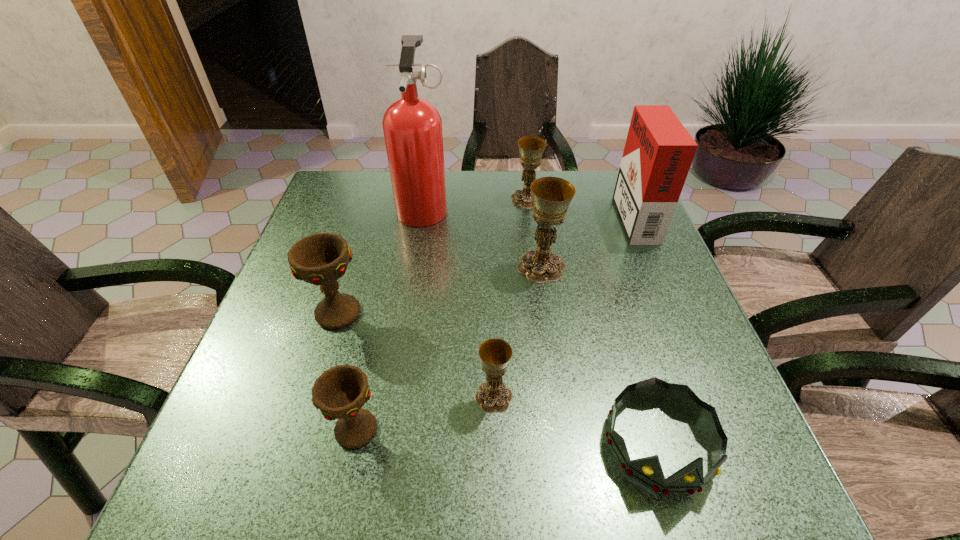
I want to click on the third chalice from left to right, so [x=492, y=396].

Locate an element on the screen. The width and height of the screenshot is (960, 540). the nearer red chalice is located at coordinates (340, 392).

Image resolution: width=960 pixels, height=540 pixels. What are the coordinates of `red tiara` in the screenshot? It's located at (648, 471).

Find the location of a particular element. free space located 0.180m on the front of the fire extinguisher is located at coordinates tap(413, 278).

Find the location of a particular element. vacant position located on the front-facing side of the red cigarette case is located at coordinates (520, 215).

Where is `vacant space situated 0.220m on the front-facing side of the red cigarette case`? The image size is (960, 540). vacant space situated 0.220m on the front-facing side of the red cigarette case is located at coordinates (539, 215).

At what (x,y) coordinates should I click in order to perform the action: click on vacant space located on the front-facing side of the red cigarette case. Please return your answer as a coordinate pair (x, y). This screenshot has height=540, width=960. Looking at the image, I should click on (546, 215).

Where is `vacant point located on the back of the fifth nearest object`? The image size is (960, 540). vacant point located on the back of the fifth nearest object is located at coordinates (534, 216).

Where is `free region located 0.320m on the left of the second smallest gold chalice`? The image size is (960, 540). free region located 0.320m on the left of the second smallest gold chalice is located at coordinates click(401, 199).

You are a GUI agent. You are given a task and a screenshot of the screen. Output one action in this format:
    pyautogui.click(x=<x>, y=<y>)
    Task: Click on the free location located 0.160m on the right of the fifth farthest object
    The height and width of the screenshot is (540, 960).
    Given the screenshot: What is the action you would take?
    pyautogui.click(x=438, y=313)